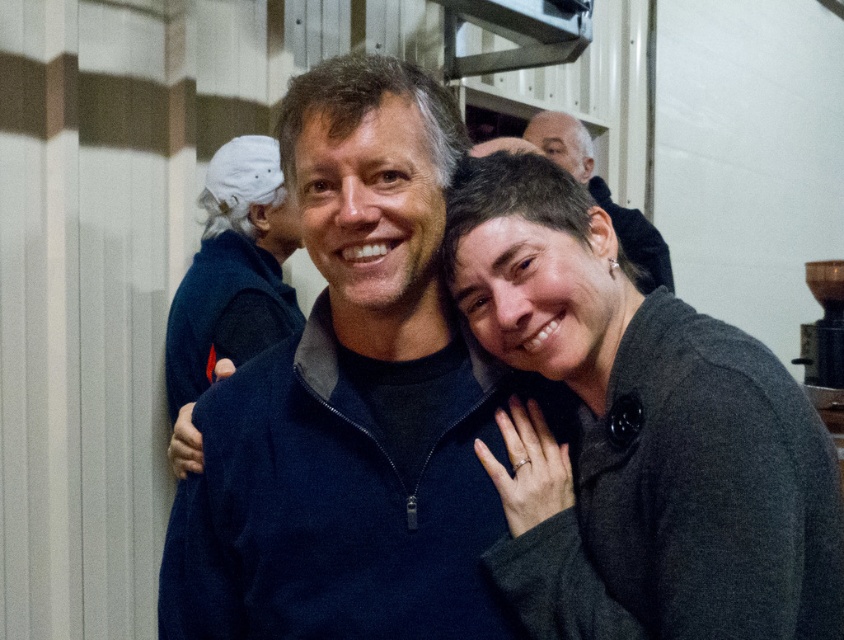
You are trying to decide which clothing item to wear for a casual day out. Both the dark blue fleece at center and the matte black sweater at center are options. Based on their sizes, which one would you choose if you prefer a looser fit?

The dark blue fleece at center has a larger width than the matte black sweater at center, so it would provide a looser fit, making it the better choice for a casual day out if you prefer a looser fit.

You are trying to decide which clothing item to wear for a casual outdoor event. Both the dark blue fleece at center and the gray woolen sweater at center are options. Based on their sizes, which one would you choose if you want something roomier?

The dark blue fleece at center might be wider than gray woolen sweater at center, so choosing the dark blue fleece at center would provide a roomier fit.